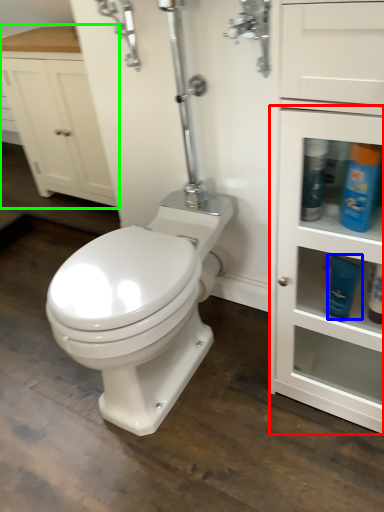
Question: Estimate the real-world distances between objects in this image. Which object is farther from cabinetry (highlighted by a red box), toiletry (highlighted by a blue box) or bathroom cabinet (highlighted by a green box)?

Choices:
 (A) toiletry
 (B) bathroom cabinet

Answer: (B)